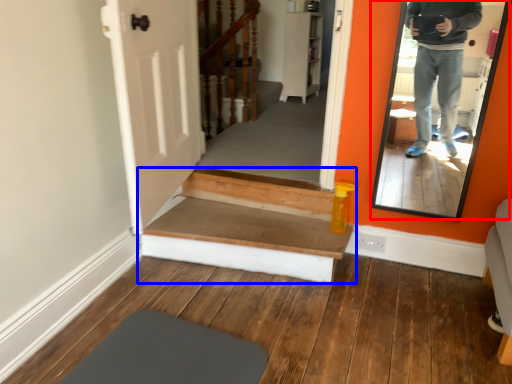
Question: Which object is closer to the camera taking this photo, mirror (highlighted by a red box) or stairs (highlighted by a blue box)?

Choices:
 (A) mirror
 (B) stairs

Answer: (A)